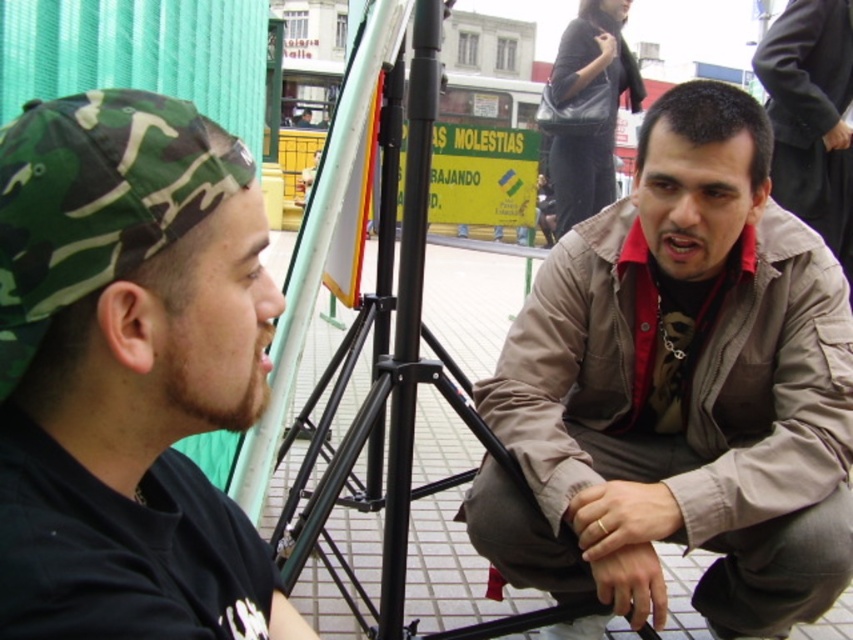
You are standing in front of the image and want to locate the camouflage fabric cap at left. Where is it positioned in terms of horizontal and vertical coordinates?

The camouflage fabric cap at left is positioned at the 2D coordinates of point 0.583 horizontally and 0.152 vertically.

You are a tailor measuring items for display. You have a shelf that can only accommodate items wider than the camouflage fabric cap at left. Can the brown matte jacket at center fit on the shelf?

The brown matte jacket at center is wider than the camouflage fabric cap at left, so it can fit on the shelf designed for items wider than the camouflage fabric cap at left.